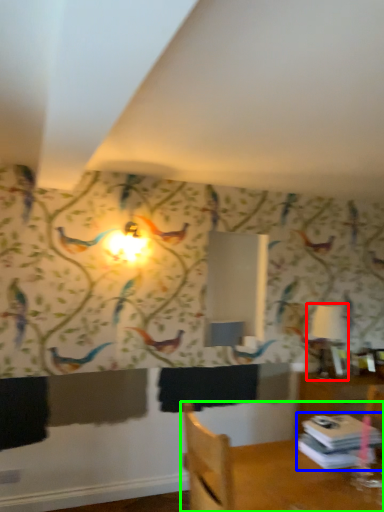
Question: Estimate the real-world distances between objects in this image. Which object is closer to table lamp (highlighted by a red box), book (highlighted by a blue box) or furniture (highlighted by a green box)?

Choices:
 (A) book
 (B) furniture

Answer: (A)